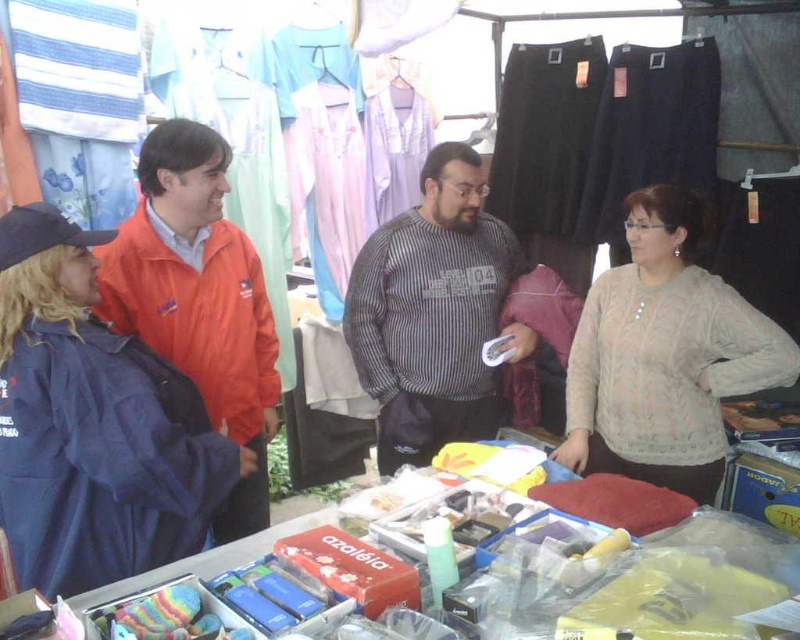
Is point (14, 518) positioned after point (380, 321)?

No.

Does matte blue jacket at left have a lesser width compared to striped sweater at center?

Indeed, matte blue jacket at left has a lesser width compared to striped sweater at center.

Measure the distance between point [81,572] and camera.

Point [81,572] and camera are 1.46 meters apart from each other.

Find the location of `matte blue jacket at left`. matte blue jacket at left is located at coordinates (93, 424).

Is light beige knitted sweater at center positioned before striped sweater at center?

That is True.

From the picture: Is light beige knitted sweater at center wider than striped sweater at center?

In fact, light beige knitted sweater at center might be narrower than striped sweater at center.

Is point (610, 433) behind point (454, 216)?

No, (610, 433) is closer to viewer.

This screenshot has width=800, height=640. What are the coordinates of `light beige knitted sweater at center` in the screenshot? It's located at coord(664,356).

Who is higher up, light beige knitted sweater at center or orange fabric jacket at left?

Positioned higher is light beige knitted sweater at center.

Does point (714, 456) come closer to viewer compared to point (166, 204)?

No, it is not.

Locate an element on the screen. This screenshot has height=640, width=800. light beige knitted sweater at center is located at coordinates (664, 356).